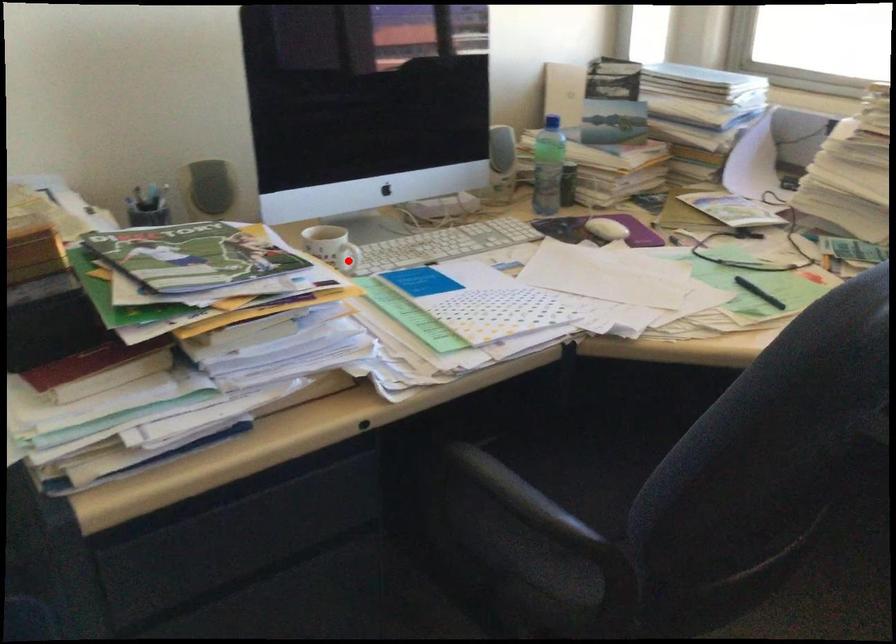
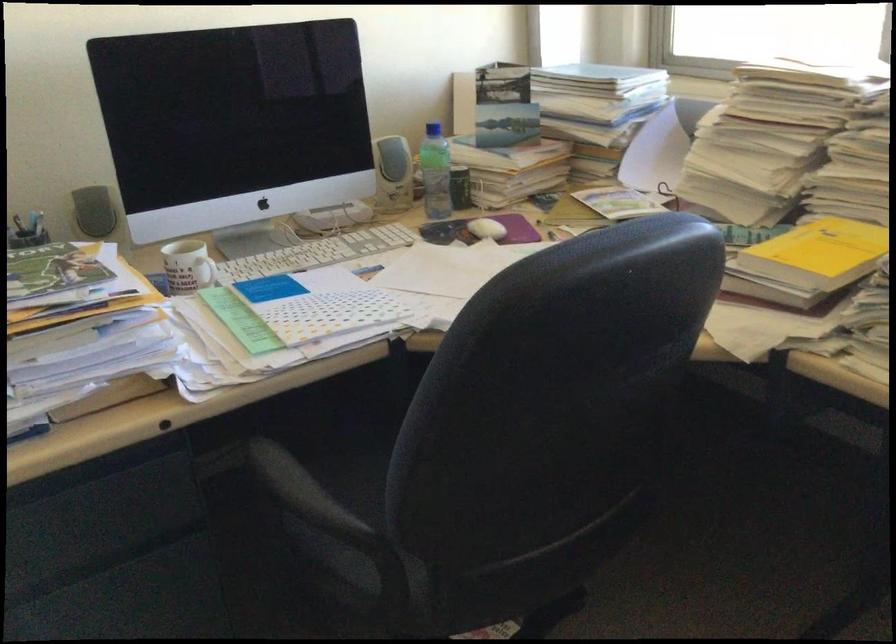
In the second image, find the point that corresponds to the highlighted location in the first image.

(204, 272)